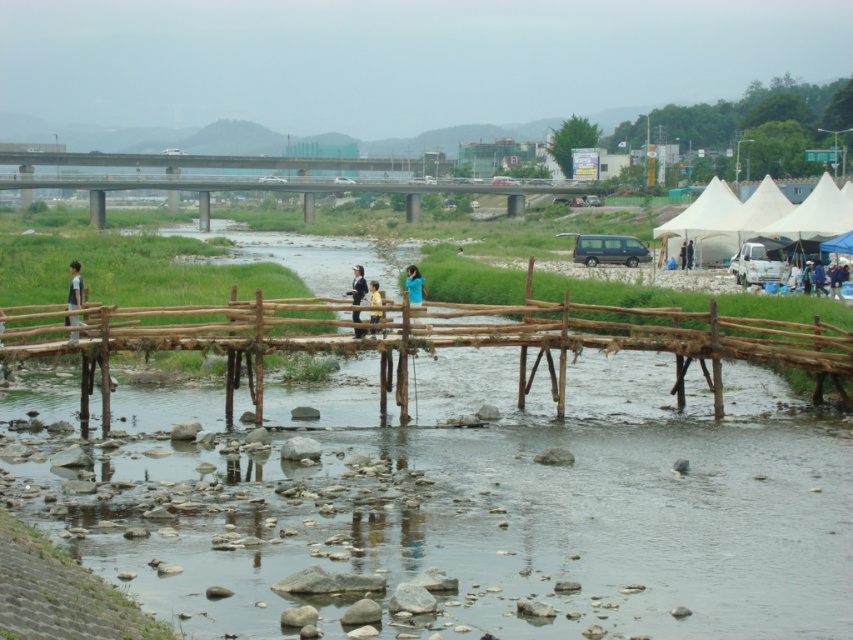
Which of these two, yellow shirt at center or wooden fence at center, stands shorter?

wooden fence at center

Is point (381, 294) closer to viewer compared to point (0, 314)?

No, (381, 294) is further to viewer.

Is point (372, 301) closer to camera compared to point (0, 346)?

No, it is not.

Find the location of a particular element. Image resolution: width=853 pixels, height=640 pixels. yellow shirt at center is located at coordinates (375, 292).

From the picture: Is natural wood bridge at center taller than light blue fabric jacket at center?

Yes.

Which is above, natural wood bridge at center or light blue fabric jacket at center?

light blue fabric jacket at center is higher up.

Image resolution: width=853 pixels, height=640 pixels. What are the coordinates of `natural wood bridge at center` in the screenshot? It's located at (473, 340).

Who is lower down, natural wood bridge at center or wooden fence at center?

wooden fence at center is lower down.

Which is behind, point (469, 326) or point (0, 346)?

Positioned behind is point (469, 326).

Where is `natural wood bridge at center`? This screenshot has width=853, height=640. natural wood bridge at center is located at coordinates (473, 340).

Locate an element on the screen. This screenshot has height=640, width=853. natural wood bridge at center is located at coordinates (473, 340).